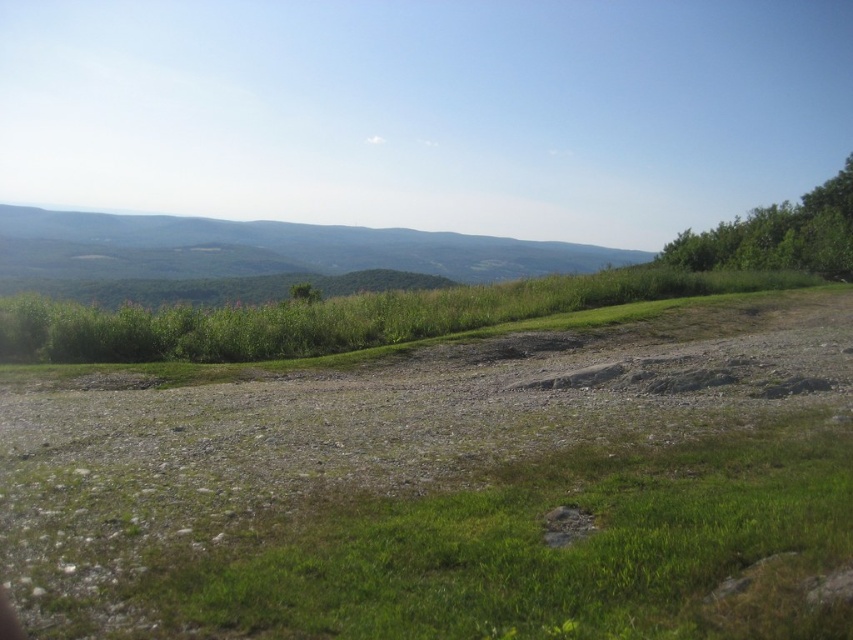
You are planning to set up a small tent in the area shown. Considering the terrain, which location would be more suitable for the tent between the dull gray gravel at center and the green leafy tree at upper right, and why?

The green leafy tree at upper right is a more suitable location for the tent because the dull gray gravel at center has a narrower width, making it less stable and spacious compared to the wider area under the green leafy tree at upper right.

You are standing at the edge of the scene and want to walk towards the green leafy tree at upper right. Will you step on the dull gray gravel at center before reaching the tree?

Yes, because the dull gray gravel at center is below the green leafy tree at upper right, meaning it is closer to your starting position. You will step on the dull gray gravel at center before reaching the green leafy tree at upper right.

You are planning to plant a new flower bed in the garden. You have two options for the location based on the image provided. The first option is near the dull gray gravel at center, and the second is near the green leafy tree at center. Considering the size of the objects in the scene, which location would provide more space for the flower bed?

The green leafy tree at center is larger than the dull gray gravel at center, so the area near the green leafy tree at center would provide more space for the flower bed.